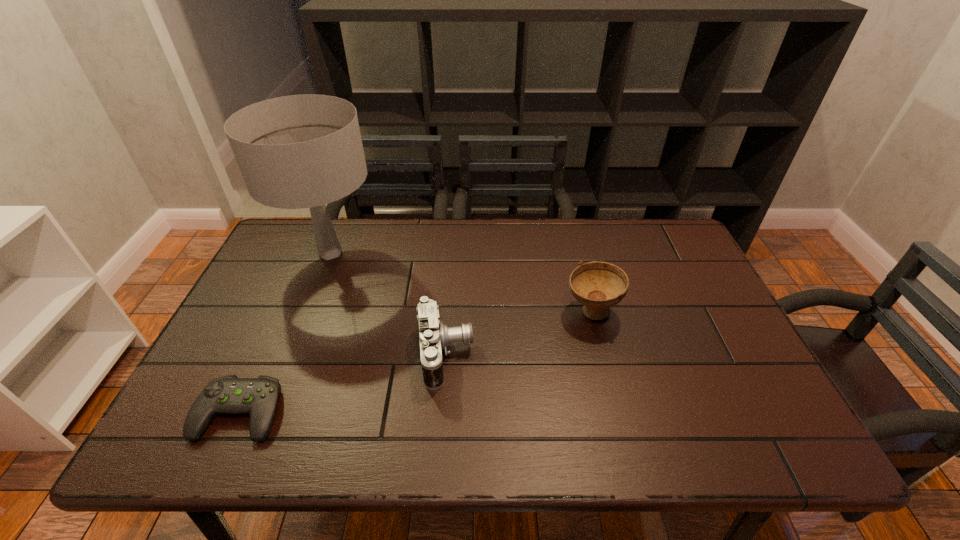
This screenshot has width=960, height=540. In order to click on vacant region between the control and the third tallest object in this screenshot , I will do `click(343, 383)`.

Identify which object is the closest to the second shortest object. Please provide its 2D coordinates. Your answer should be formatted as a tuple, i.e. [(x, y)], where the tuple contains the x and y coordinates of a point satisfying the conditions above.

[(301, 151)]

Select which object appears as the third closest to the third object from left to right. Please provide its 2D coordinates. Your answer should be formatted as a tuple, i.e. [(x, y)], where the tuple contains the x and y coordinates of a point satisfying the conditions above.

[(258, 397)]

Find the location of `vacant region that satisfies the following two spatial constraints: 1. on the front-facing side of the soup bowl; 2. on the left side of the farthest object`. vacant region that satisfies the following two spatial constraints: 1. on the front-facing side of the soup bowl; 2. on the left side of the farthest object is located at coordinates (306, 312).

Locate an element on the screen. free spot that satisfies the following two spatial constraints: 1. on the front-facing side of the rightmost object; 2. on the right side of the tallest object is located at coordinates (306, 312).

Where is `vacant space that satisfies the following two spatial constraints: 1. on the front-facing side of the lampshade; 2. on the right side of the soup bowl`? vacant space that satisfies the following two spatial constraints: 1. on the front-facing side of the lampshade; 2. on the right side of the soup bowl is located at coordinates pos(306,312).

At what (x,y) coordinates should I click in order to perform the action: click on vacant space that satisfies the following two spatial constraints: 1. at the lens of the camera; 2. on the front side of the control. Please return your answer as a coordinate pair (x, y). This screenshot has width=960, height=540. Looking at the image, I should click on (442, 413).